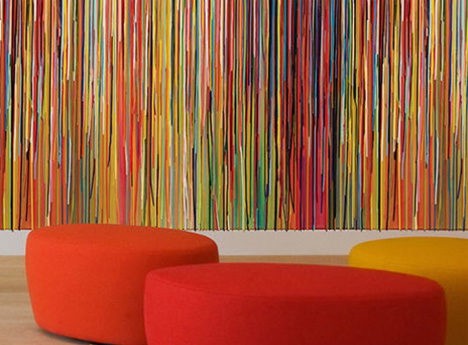
Find the location of a particular element. This screenshot has width=468, height=345. top of yellow ottoman is located at coordinates (424, 254).